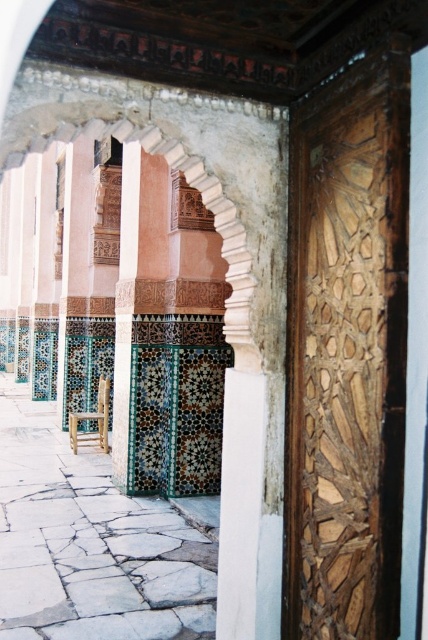
Question: Which of the following is the closest to the observer?

Choices:
 (A) (127, 358)
 (B) (88, 436)

Answer: (A)

Question: Is green mosaic tile at center above wooden chair at center?

Choices:
 (A) no
 (B) yes

Answer: (B)

Question: Is green mosaic tile at center wider than wooden chair at center?

Choices:
 (A) no
 (B) yes

Answer: (A)

Question: Which object is farther from the camera taking this photo?

Choices:
 (A) green mosaic tile at center
 (B) wooden chair at center

Answer: (B)

Question: Can you confirm if green mosaic tile at center is wider than wooden chair at center?

Choices:
 (A) yes
 (B) no

Answer: (B)